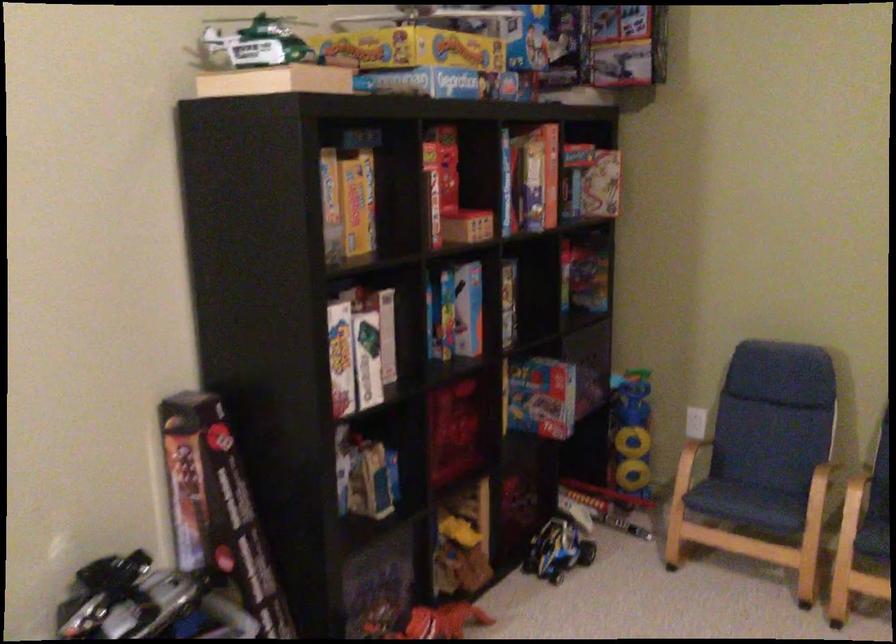
The width and height of the screenshot is (896, 644). What are the coordinates of `blue chair sitting surface` in the screenshot? It's located at (747, 500).